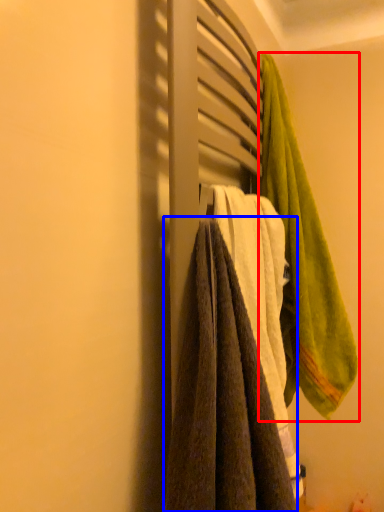
Question: Among these objects, which one is farthest to the camera, towel (highlighted by a red box) or towel (highlighted by a blue box)?

Choices:
 (A) towel
 (B) towel

Answer: (A)